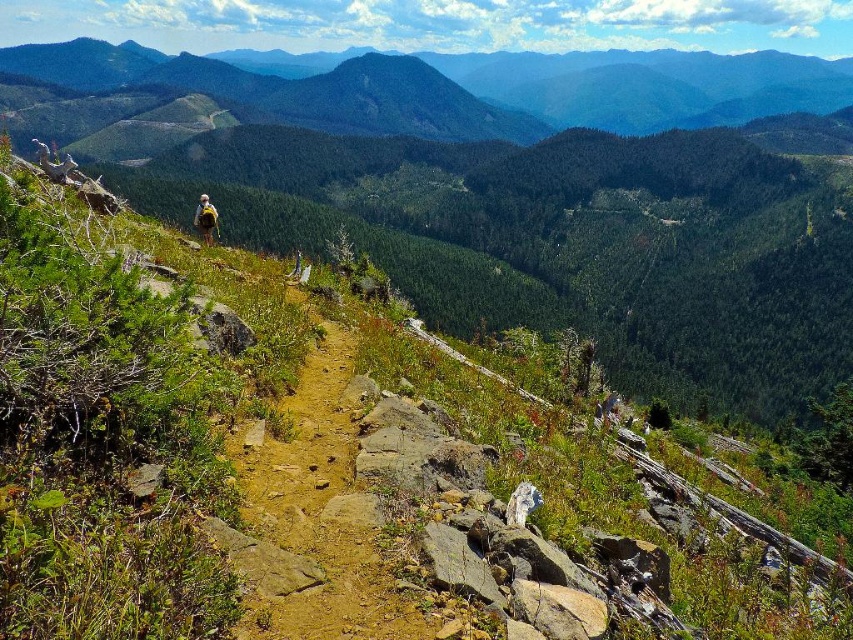
You are a hiker planning to take the dirt path at center to reach the green forested mountain at upper center. Based on the scene, can you determine if the mountain is taller than the path?

The green forested mountain at upper center is taller than the dirt path at center, so yes, the mountain is taller than the path.